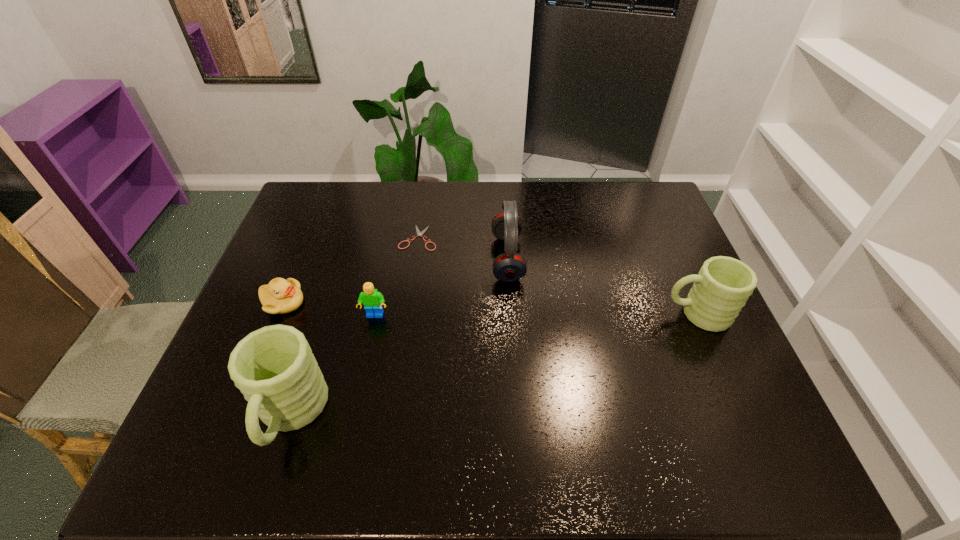
If equal spacing is desired by inserting an extra mug among them, please point out a free spot for this new mug. Please provide its 2D coordinates. Your answer should be formatted as a tuple, i.e. [(x, y)], where the tuple contains the x and y coordinates of a point satisfying the conditions above.

[(513, 360)]